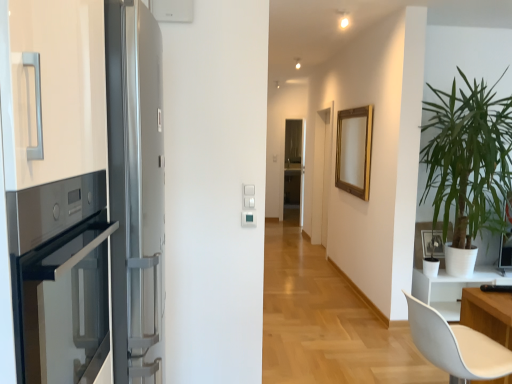
Image resolution: width=512 pixels, height=384 pixels. Identify the location of satin silver fridge at left. (98, 218).

Looking at this image, in order to face white matte chair at lower right, should I rotate leftwards or rightwards?

A 25.725 degree turn to the right will do.

What do you see at coordinates (354, 151) in the screenshot?
I see `gold metallic picture frame at upper center, which is counted as the second picture frame, starting from the bottom` at bounding box center [354, 151].

What do you see at coordinates (469, 159) in the screenshot?
I see `green leafy plant at right` at bounding box center [469, 159].

At what (x,y) coordinates should I click in order to perform the action: click on white matte picture frame at right, placed as the first picture frame when sorted from bottom to top. Please return your answer as a coordinate pair (x, y). Looking at the image, I should click on (419, 243).

Where is `satin silver fridge at left`? The height and width of the screenshot is (384, 512). satin silver fridge at left is located at coordinates (98, 218).

Is white matte chair at lower right smaller than transparent glass screen door at center?

Incorrect, white matte chair at lower right is not smaller in size than transparent glass screen door at center.

Is white matte chair at lower right outside of transparent glass screen door at center?

Yes, white matte chair at lower right is outside of transparent glass screen door at center.

Can you see white matte chair at lower right touching transparent glass screen door at center?

white matte chair at lower right is not next to transparent glass screen door at center, and they're not touching.

Is white matte chair at lower right taller than transparent glass screen door at center?

No.

In terms of width, does transparent glass screen door at center look wider or thinner when compared to green leafy plant at right?

transparent glass screen door at center is thinner than green leafy plant at right.

From the picture: From the image's perspective, is transparent glass screen door at center over green leafy plant at right?

Indeed, from the image's perspective, transparent glass screen door at center is shown above green leafy plant at right.

The width and height of the screenshot is (512, 384). Identify the location of houseplant below the transparent glass screen door at center (from the image's perspective). (469, 159).

Does satin silver fridge at left have a lesser width compared to transparent glass screen door at center?

Incorrect, the width of satin silver fridge at left is not less than that of transparent glass screen door at center.

In the scene shown: Is satin silver fridge at left bigger or smaller than transparent glass screen door at center?

satin silver fridge at left is bigger than transparent glass screen door at center.

Is satin silver fridge at left aimed at transparent glass screen door at center?

No, satin silver fridge at left is not turned towards transparent glass screen door at center.

Consider the image. From the image's perspective, does satin silver fridge at left appear higher than transparent glass screen door at center?

No, from the image's perspective, satin silver fridge at left is not above transparent glass screen door at center.

From a real-world perspective, which object stands above the other?

green leafy plant at right, from a real-world perspective.

Between point (127, 245) and point (464, 102), which one is positioned in front?

The point (127, 245) is closer.

Does satin silver fridge at left have a smaller size compared to green leafy plant at right?

Correct, satin silver fridge at left occupies less space than green leafy plant at right.

Which object is positioned more to the right, satin silver fridge at left or green leafy plant at right?

Positioned to the right is green leafy plant at right.

How different are the orientations of green leafy plant at right and transparent glass screen door at center in degrees?

3 degrees.

From a real-world perspective, is green leafy plant at right above or below transparent glass screen door at center?

green leafy plant at right is above transparent glass screen door at center.

Identify the location of screen door above the green leafy plant at right (from the image's perspective). (294, 163).

Is green leafy plant at right far away from transparent glass screen door at center?

That's right, there is a large distance between green leafy plant at right and transparent glass screen door at center.

From the picture: Is white matte chair at lower right positioned with its back to white matte picture frame at right, which appears as the 2th picture frame when viewed from the top?

No, white matte chair at lower right is not facing away from white matte picture frame at right, which appears as the 2th picture frame when viewed from the top.

Is point (479, 339) less distant than point (420, 229)?

Yes, point (479, 339) is closer to viewer.

Is white matte chair at lower right placed right next to white matte picture frame at right, placed as the first picture frame when sorted from bottom to top?

No, white matte chair at lower right is not making contact with white matte picture frame at right, placed as the first picture frame when sorted from bottom to top.

Which of these two, gold metallic picture frame at upper center, which is counted as the first picture frame, starting from the top, or satin black oven at left, is wider?

satin black oven at left is wider.

From a real-world perspective, is gold metallic picture frame at upper center, which ranks as the 1th picture frame in back-to-front order, beneath satin black oven at left?

No, from a real-world perspective, gold metallic picture frame at upper center, which ranks as the 1th picture frame in back-to-front order, is not beneath satin black oven at left.

Is gold metallic picture frame at upper center, which ranks as the 1th picture frame in back-to-front order, surrounding satin black oven at left?

No, satin black oven at left is not inside gold metallic picture frame at upper center, which ranks as the 1th picture frame in back-to-front order.

Considering the sizes of objects gold metallic picture frame at upper center, positioned as the second picture frame in front-to-back order, and satin black oven at left in the image provided, who is shorter, gold metallic picture frame at upper center, positioned as the second picture frame in front-to-back order, or satin black oven at left?

With less height is satin black oven at left.

Locate an element on the screen. The image size is (512, 384). chair below the transparent glass screen door at center (from the image's perspective) is located at coordinates (456, 346).

Locate an element on the screen. screen door beneath the green leafy plant at right (from a real-world perspective) is located at coordinates (294, 163).

Based on their spatial positions, is gold metallic picture frame at upper center, which is counted as the second picture frame, starting from the bottom, or transparent glass screen door at center closer to green leafy plant at right?

Among the two, gold metallic picture frame at upper center, which is counted as the second picture frame, starting from the bottom, is located nearer to green leafy plant at right.

Based on their spatial positions, is gold metallic picture frame at upper center, which ranks as the 1th picture frame in back-to-front order, or white matte chair at lower right further from transparent glass screen door at center?

white matte chair at lower right is further to transparent glass screen door at center.

From the picture: Based on their spatial positions, is green leafy plant at right or transparent glass screen door at center closer to satin black oven at left?

green leafy plant at right.

Based on their spatial positions, is gold metallic picture frame at upper center, which is counted as the second picture frame, starting from the bottom, or green leafy plant at right further from transparent glass screen door at center?

→ Based on the image, green leafy plant at right appears to be further to transparent glass screen door at center.

Considering their positions, is transparent glass screen door at center positioned further to satin silver fridge at left than white matte picture frame at right, placed as the first picture frame when sorted from bottom to top?

transparent glass screen door at center is positioned further to the anchor satin silver fridge at left.

Which object lies further to the anchor point transparent glass screen door at center, satin silver fridge at left or gold metallic picture frame at upper center, which is counted as the first picture frame, starting from the top?

satin silver fridge at left lies further to transparent glass screen door at center than the other object.

When comparing their distances from gold metallic picture frame at upper center, arranged as the second picture frame when viewed from the right, does white matte chair at lower right or satin silver fridge at left seem closer?

white matte chair at lower right is closer to gold metallic picture frame at upper center, arranged as the second picture frame when viewed from the right.

When comparing their distances from green leafy plant at right, does white matte chair at lower right or gold metallic picture frame at upper center, which ranks as the 1th picture frame in back-to-front order, seem closer?

Based on the image, gold metallic picture frame at upper center, which ranks as the 1th picture frame in back-to-front order, appears to be nearer to green leafy plant at right.

The width and height of the screenshot is (512, 384). I want to click on picture frame between white matte picture frame at right, which appears as the 2th picture frame when viewed from the top, and transparent glass screen door at center in the front-back direction, so click(x=354, y=151).

Identify the location of houseplant located between satin black oven at left and white matte picture frame at right, placed as the first picture frame when sorted from front to back, in the depth direction. The image size is (512, 384). click(x=469, y=159).

The image size is (512, 384). In order to click on chair located between satin black oven at left and gold metallic picture frame at upper center, which is counted as the second picture frame, starting from the bottom, in the depth direction in this screenshot , I will do `click(456, 346)`.

The image size is (512, 384). What are the coordinates of `chair between satin silver fridge at left and green leafy plant at right from left to right` in the screenshot? It's located at (456, 346).